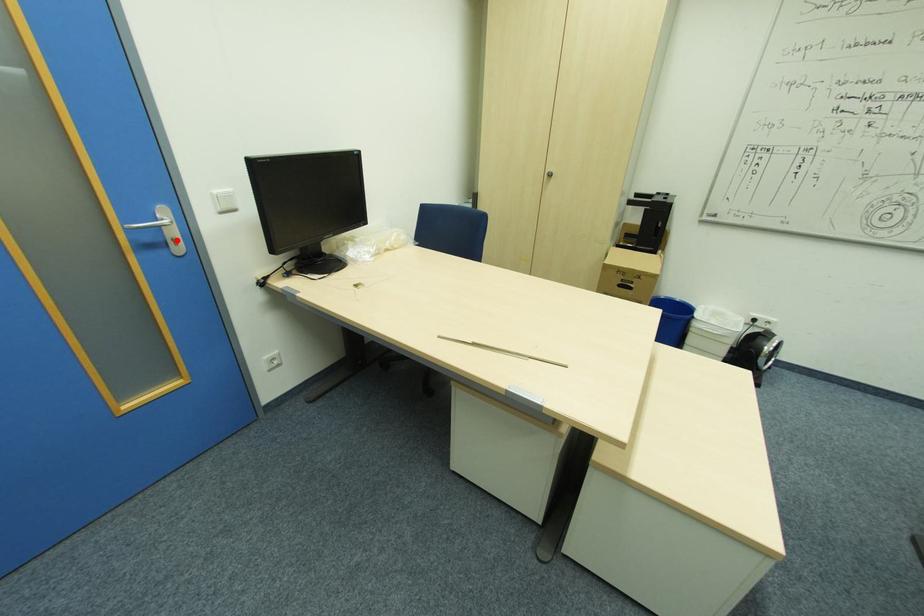
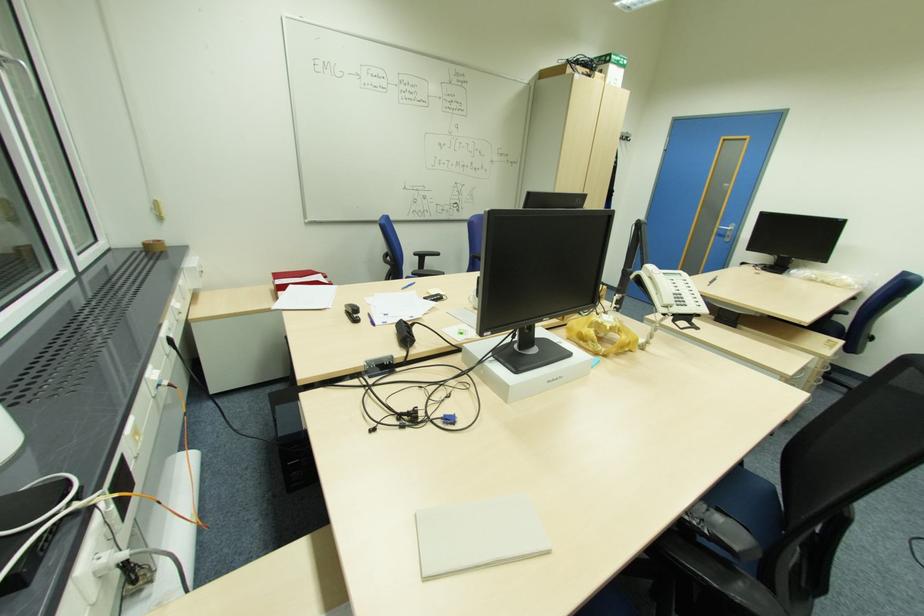
In the second image, find the point that corresponds to the highlighted location in the first image.

(732, 236)